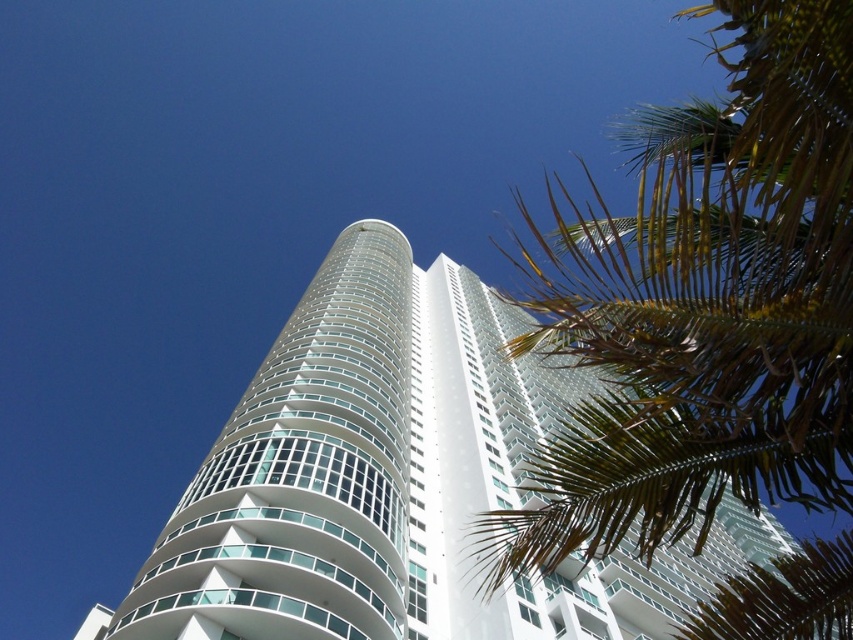
You are standing in front of the modern high rise building with cylindrical section on the left and rectangular section on the right. You see a point at coordinate (705,307). What object is located at this coordinate?

The point at coordinate (705,307) corresponds to the green leafy palm tree at upper right.

You are standing in front of the white glass building at center and want to get a clear view of it. Since the green leafy palm tree at upper right is blocking your view, which direction should you move to avoid the obstruction?

You should move to the left to avoid the green leafy palm tree at upper right, as it is to the right of the white glass building at center.

Based on the photo, you are an architect designing a new park layout. You want to place a bench between the green leafy palm tree at upper right and the white glass building at center so that it is equidistant from both. Given that the palm tree is thinner than the building, which side of the bench should be closer to the palm tree to achieve equal distance?

The bench should be placed closer to the green leafy palm tree at upper right because it is thinner than the white glass building at center, so positioning the bench nearer to the palm tree ensures equal distance from both objects.